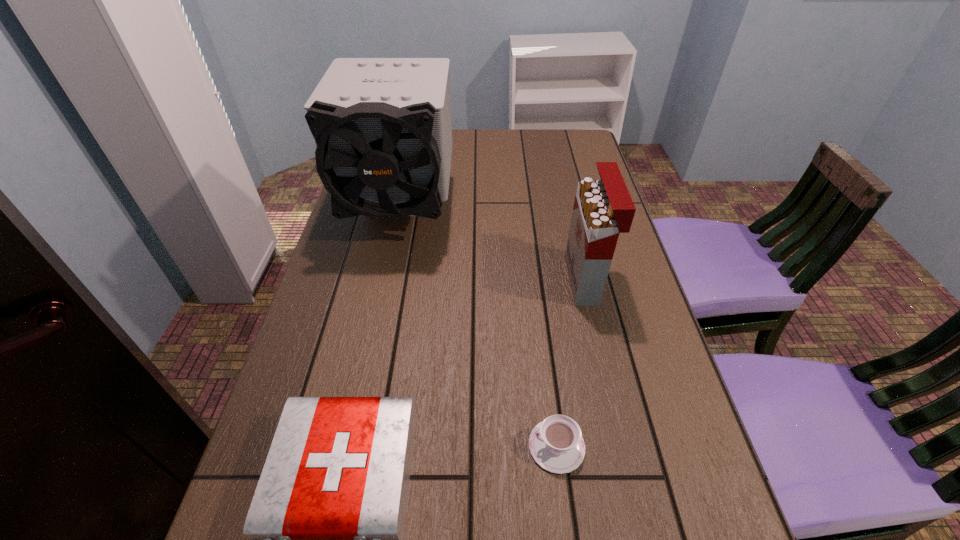
Where is `vacant space positioned 0.120m on the handle side of the teacup`? Image resolution: width=960 pixels, height=540 pixels. vacant space positioned 0.120m on the handle side of the teacup is located at coordinates (463, 446).

You are a GUI agent. You are given a task and a screenshot of the screen. Output one action in this format:
    pyautogui.click(x=<x>, y=<y>)
    Task: Click on the free space located on the handle side of the teacup
    
    Given the screenshot: What is the action you would take?
    pyautogui.click(x=403, y=446)

What are the coordinates of `blank space located 0.240m on the handle side of the teacup` in the screenshot? It's located at (397, 446).

What are the coordinates of `object at the left edge` in the screenshot? It's located at (382, 126).

This screenshot has width=960, height=540. I want to click on object present at the right edge, so click(x=603, y=208).

This screenshot has width=960, height=540. What are the coordinates of `vacant region at the far edge` in the screenshot? It's located at (461, 153).

This screenshot has width=960, height=540. I want to click on free space at the left edge of the desktop, so click(x=317, y=338).

Where is `vacant space at the right edge`? Image resolution: width=960 pixels, height=540 pixels. vacant space at the right edge is located at coordinates (581, 171).

At what (x,y) coordinates should I click in order to perform the action: click on free location at the far right corner of the desktop. Please return your answer as a coordinate pair (x, y). This screenshot has height=540, width=960. Looking at the image, I should click on (573, 130).

I want to click on free area in between the shortest object and the second farthest object, so click(571, 363).